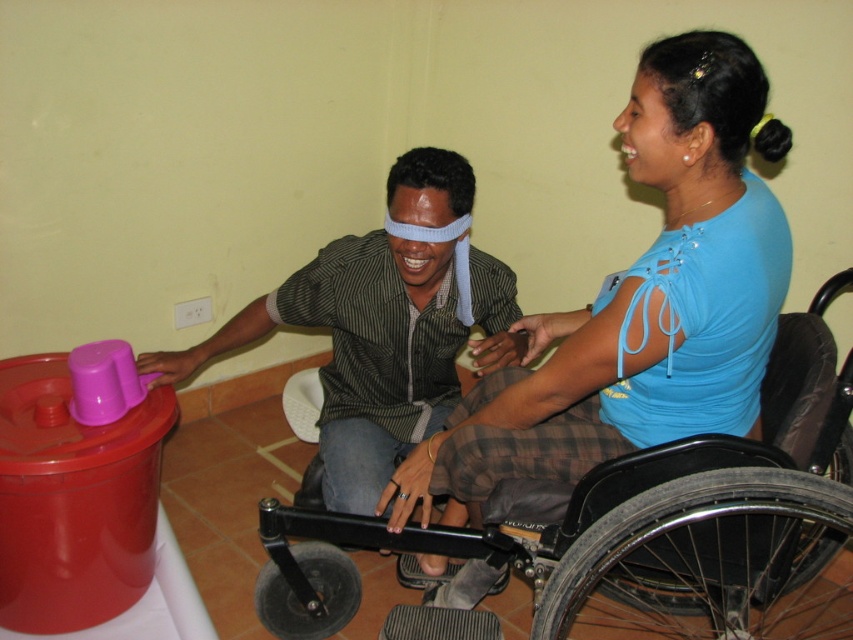
Question: Among these objects, which one is nearest to the camera?

Choices:
 (A) matte black shirt at center
 (B) blue cotton shirt at center

Answer: (B)

Question: From the image, what is the correct spatial relationship of matte black shirt at center in relation to smooth skin forehead at center?

Choices:
 (A) below
 (B) above

Answer: (A)

Question: Is blue cotton shirt at center above smooth skin forehead at center?

Choices:
 (A) yes
 (B) no

Answer: (B)

Question: Does blue cotton shirt at center have a smaller size compared to black plastic wheelchair at center?

Choices:
 (A) no
 (B) yes

Answer: (B)

Question: Which of the following is the farthest from the observer?

Choices:
 (A) (354, 280)
 (B) (531, 413)
 (C) (668, 579)
 (D) (427, 196)

Answer: (A)

Question: Which of the following is the closest to the observer?

Choices:
 (A) (416, 208)
 (B) (535, 426)
 (C) (630, 557)

Answer: (C)